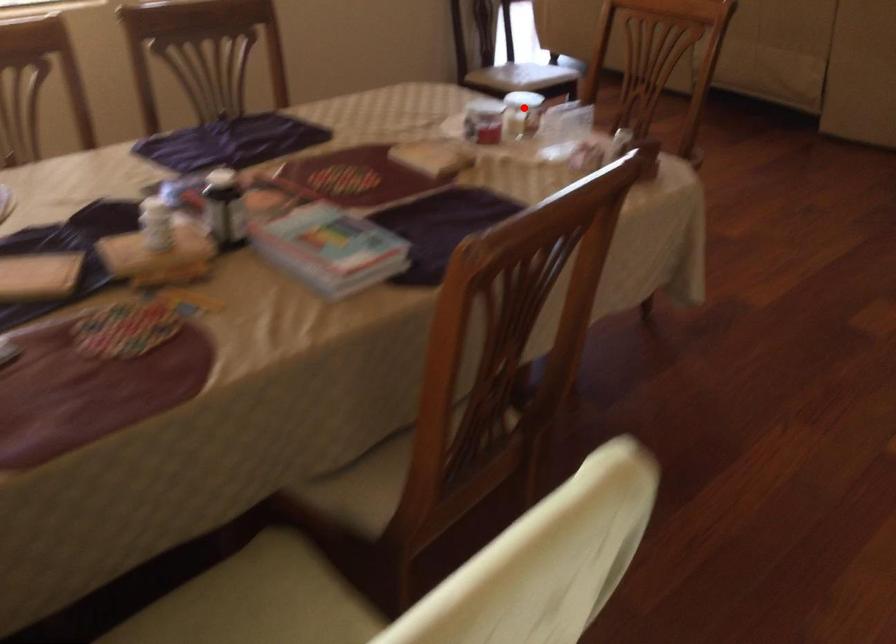
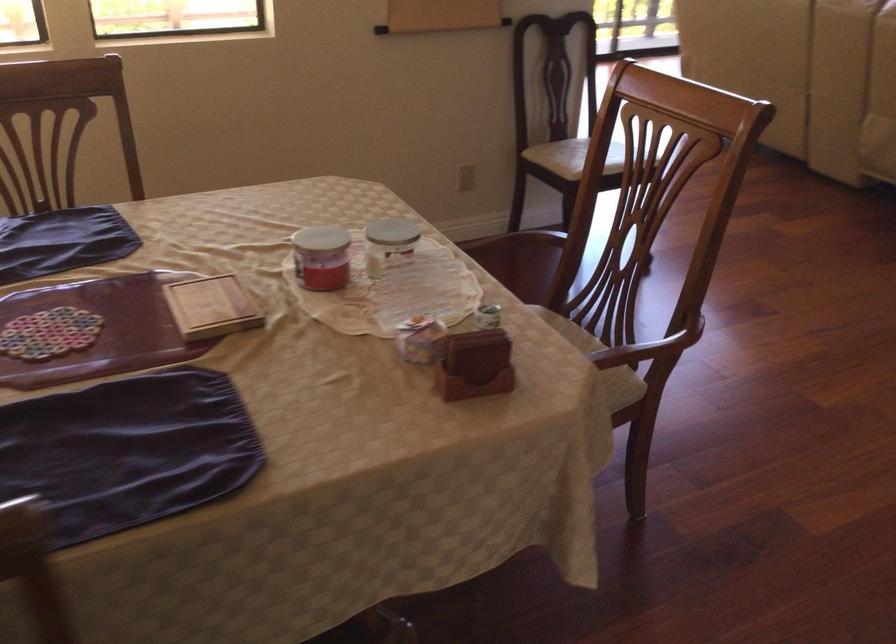
Question: I am providing you with two images of the same scene from different viewpoints. A red point is marked on the first image. Can you still see the location of the red point in image 2?

Choices:
 (A) Yes
 (B) No

Answer: (A)